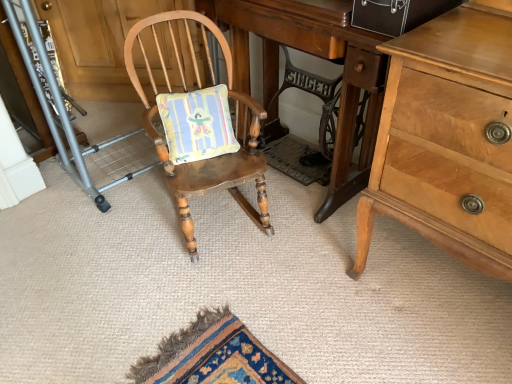
Question: Looking at the image, does wooden rocking chair at center seem bigger or smaller compared to wooden desk at center?

Choices:
 (A) small
 (B) big

Answer: (A)

Question: Is wooden rocking chair at center in front of or behind wooden desk at center in the image?

Choices:
 (A) behind
 (B) front

Answer: (B)

Question: Estimate the real-world distances between objects in this image. Which object is closer to the brushed metal folding chair at left?

Choices:
 (A) wooden rocking chair at center
 (B) light brown wooden chest of drawers at right
 (C) wooden desk at center

Answer: (A)

Question: Estimate the real-world distances between objects in this image. Which object is farther from the brushed metal folding chair at left?

Choices:
 (A) light brown wooden chest of drawers at right
 (B) wooden desk at center
 (C) wooden rocking chair at center

Answer: (A)